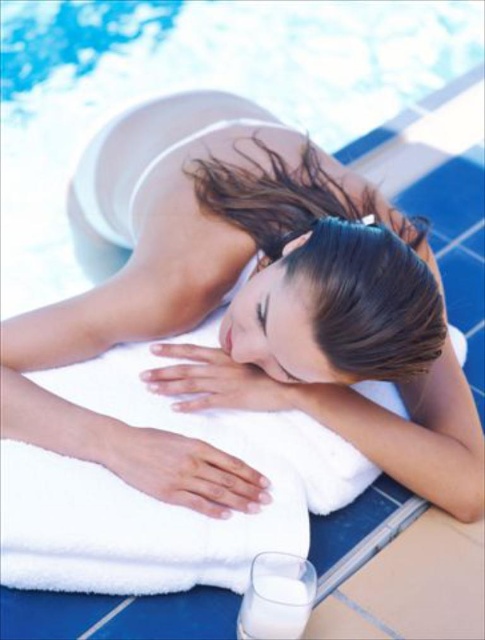
You are a lifeguard on duty and need to retrieve the white opaque glass at lower center from the pool. The white soft towel at upper center is in the way. Can you move the towel to access the glass?

The white soft towel at upper center is much taller than the white opaque glass at lower center, so you can move the towel aside to access the glass since it is taller and easier to lift out of the way.